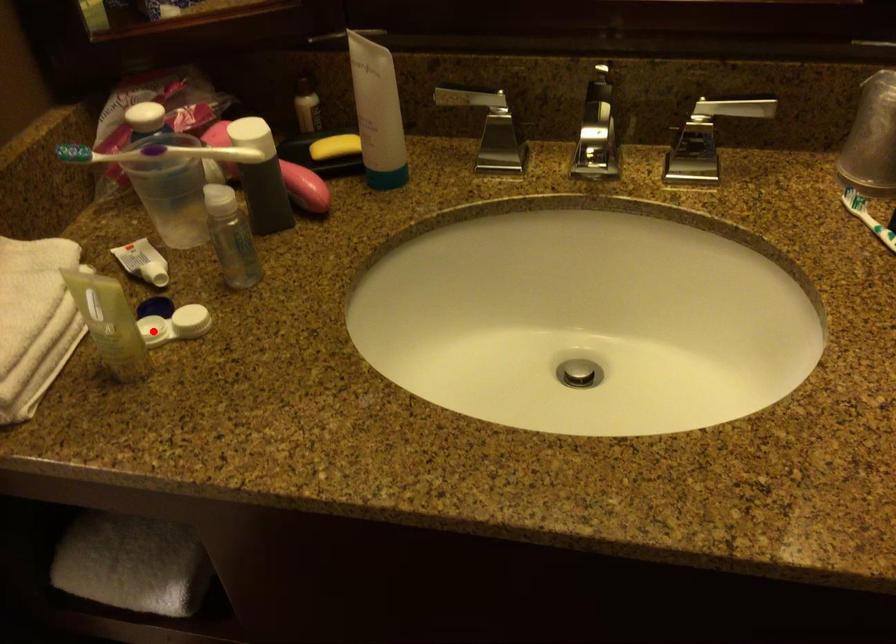
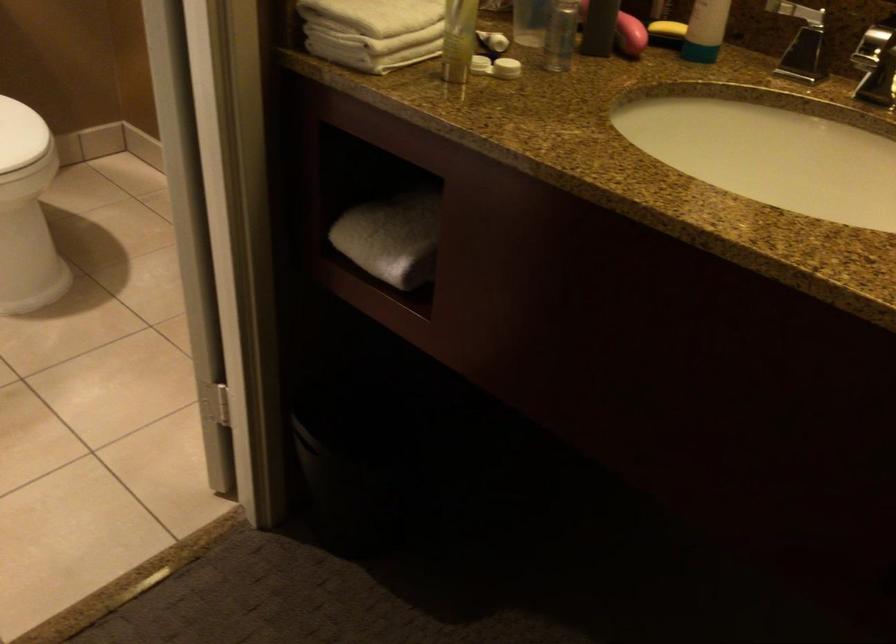
Find the pixel in the second image that matches the highlighted location in the first image.

(479, 64)